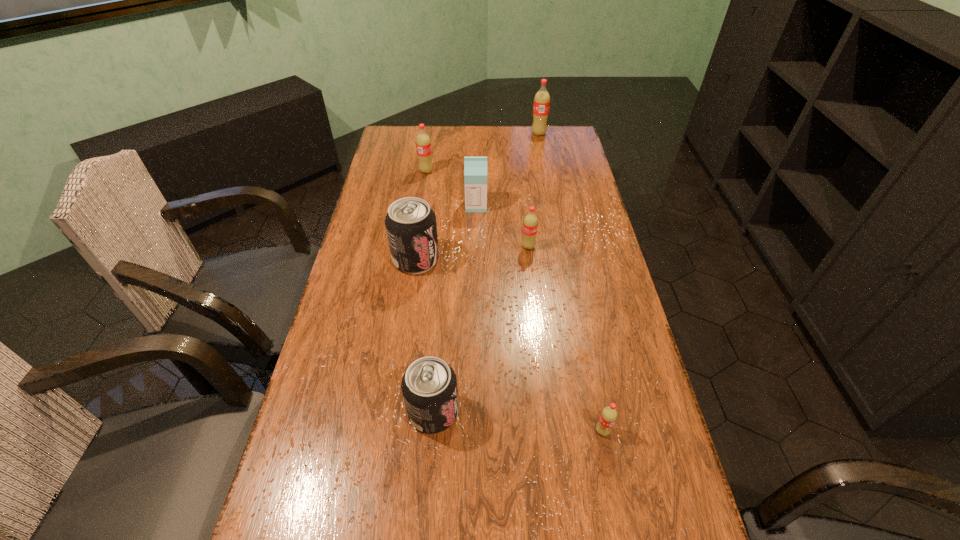
You are a GUI agent. You are given a task and a screenshot of the screen. Output one action in this format:
    pyautogui.click(x=<x>, y=<y>)
    Task: Click on the object located at the left edge
    
    Given the screenshot: What is the action you would take?
    pyautogui.click(x=410, y=223)

Find the location of a particular element. This screenshot has width=960, height=540. object that is at the far right corner is located at coordinates (541, 105).

In the image, there is a desktop. Where is `free space at the far edge`? Image resolution: width=960 pixels, height=540 pixels. free space at the far edge is located at coordinates [x=522, y=127].

You are a GUI agent. You are given a task and a screenshot of the screen. Output one action in this format:
    pyautogui.click(x=<x>, y=<y>)
    Task: Click on the vacant space at the left edge of the desktop
    The height and width of the screenshot is (540, 960).
    Given the screenshot: What is the action you would take?
    pyautogui.click(x=380, y=222)

The width and height of the screenshot is (960, 540). I want to click on vacant space at the right edge of the desktop, so click(573, 168).

I want to click on free region at the far right corner of the desktop, so click(564, 127).

Where is `unoccupied position between the second nearest red soda and the shortest soda`? Image resolution: width=960 pixels, height=540 pixels. unoccupied position between the second nearest red soda and the shortest soda is located at coordinates coord(565,339).

The height and width of the screenshot is (540, 960). Identify the location of free spot between the farther black soda can and the second red soda from left to right. (472, 253).

Identify the location of free space that is in between the tallest soda and the third biggest red soda. The image size is (960, 540). (534, 190).

I want to click on free point between the third farthest object and the nearer black soda can, so click(x=455, y=309).